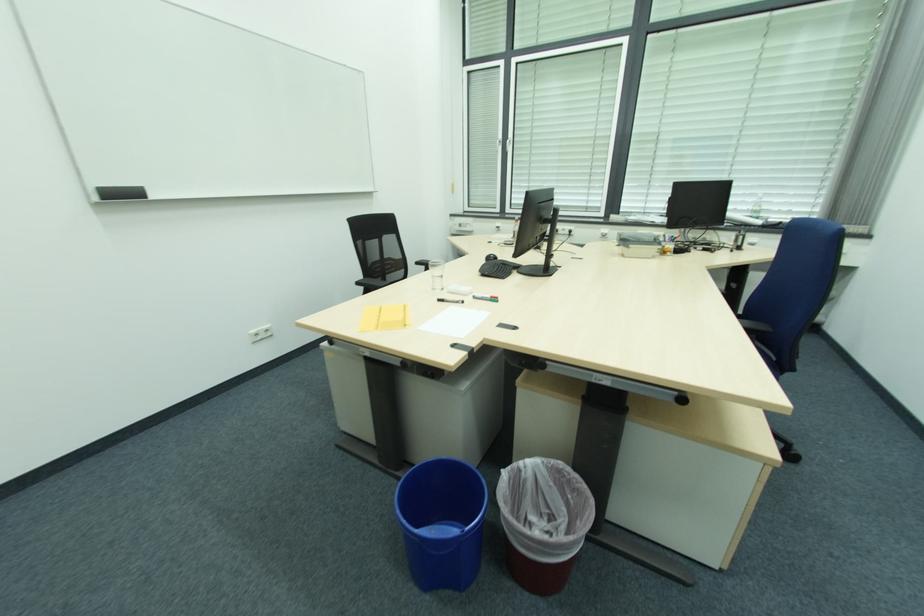
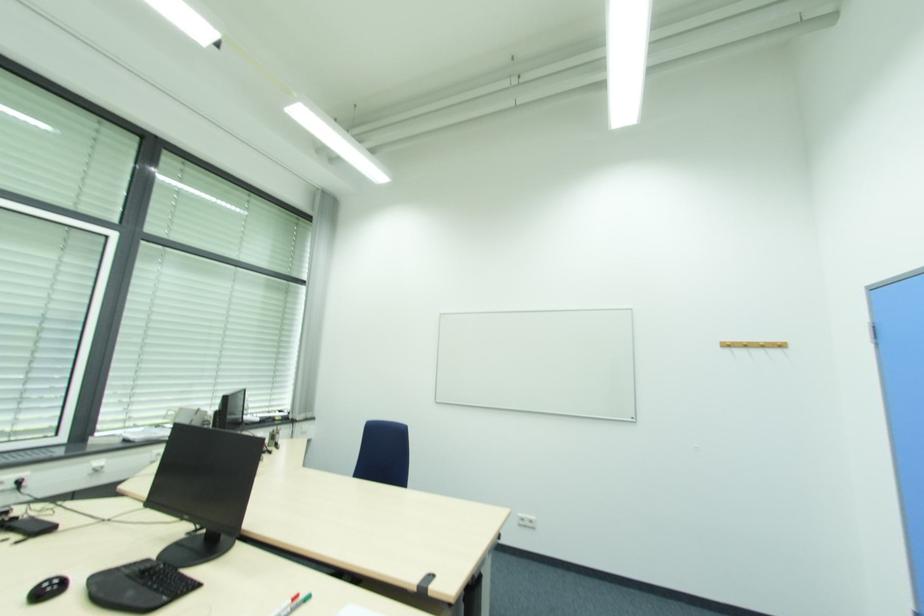
Where in the second image is the point corresponding to pixel 499 299 from the first image?

(298, 599)